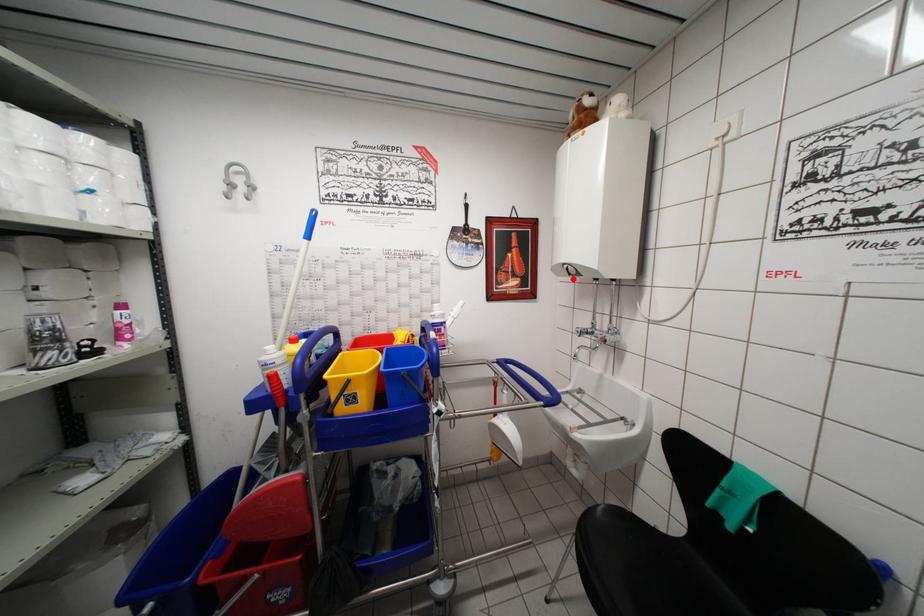
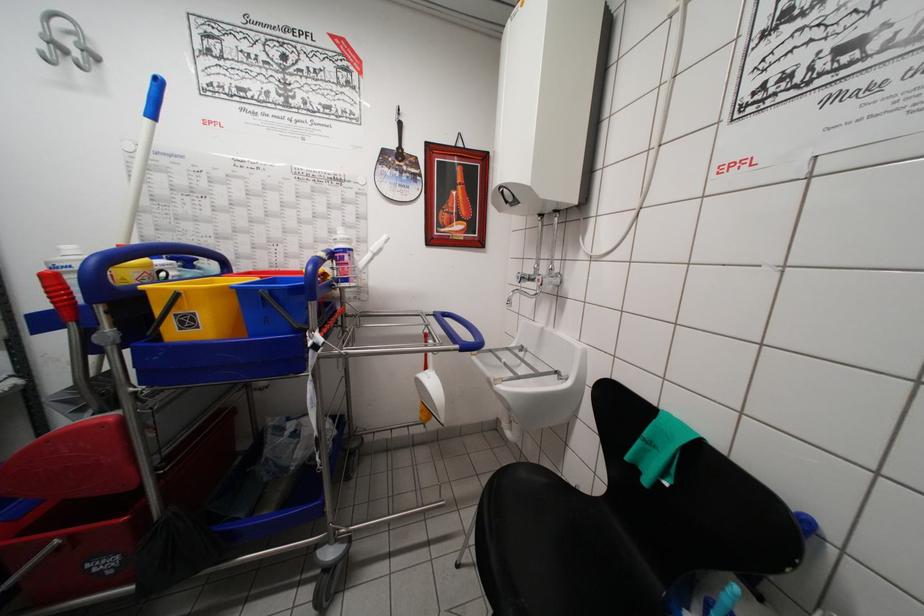
Find the pixel in the second image that matches the highlighted location in the first image.

(511, 207)